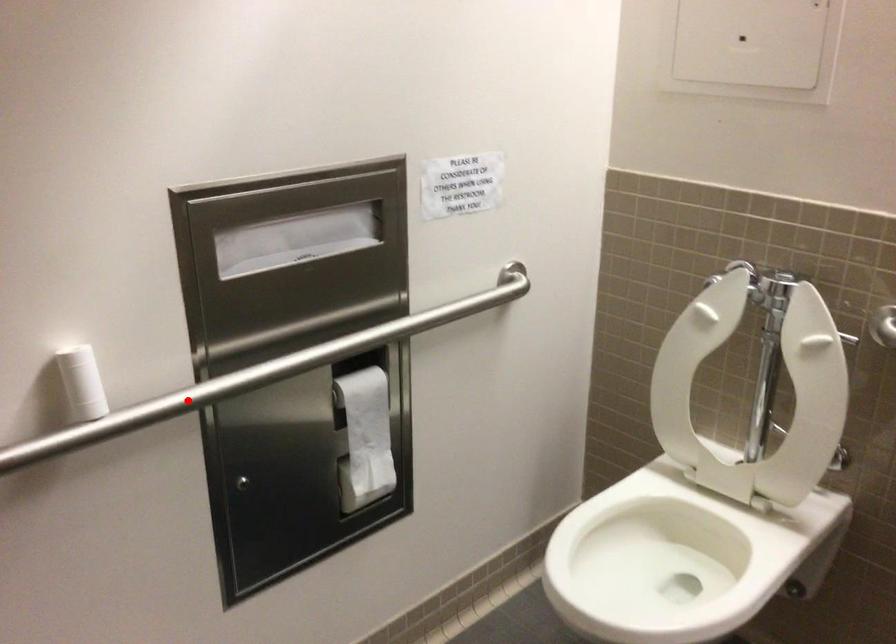
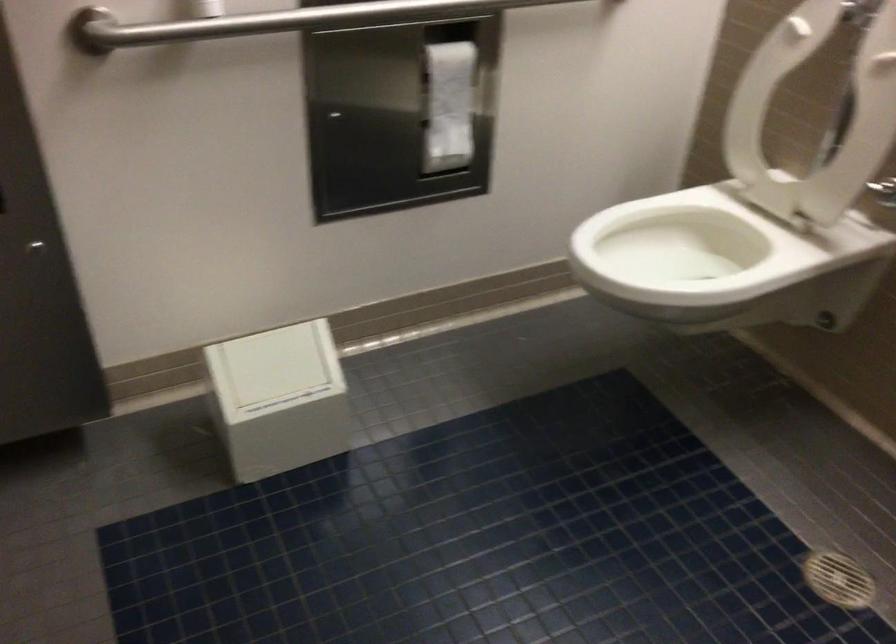
Find the pixel in the second image that matches the highlighted location in the first image.

(279, 21)